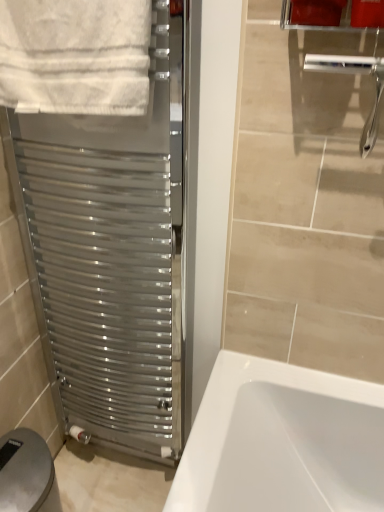
Question: Can you confirm if white cotton towel at upper left is bigger than satin metallic towel warmer at left?

Choices:
 (A) no
 (B) yes

Answer: (A)

Question: From a real-world perspective, does white cotton towel at upper left stand above satin metallic towel warmer at left?

Choices:
 (A) yes
 (B) no

Answer: (A)

Question: Is white cotton towel at upper left turned away from satin metallic towel warmer at left?

Choices:
 (A) yes
 (B) no

Answer: (A)

Question: Would you say white cotton towel at upper left is outside satin metallic towel warmer at left?

Choices:
 (A) no
 (B) yes

Answer: (A)

Question: Is white cotton towel at upper left shorter than satin metallic towel warmer at left?

Choices:
 (A) yes
 (B) no

Answer: (A)

Question: From the image's perspective, is white cotton towel at upper left over satin metallic towel warmer at left?

Choices:
 (A) no
 (B) yes

Answer: (B)

Question: From the image's perspective, would you say satin metallic towel warmer at left is shown under white cotton towel at upper left?

Choices:
 (A) yes
 (B) no

Answer: (A)

Question: Considering the relative sizes of satin metallic towel warmer at left and white cotton towel at upper left in the image provided, is satin metallic towel warmer at left thinner than white cotton towel at upper left?

Choices:
 (A) no
 (B) yes

Answer: (A)

Question: Is satin metallic towel warmer at left looking in the opposite direction of white cotton towel at upper left?

Choices:
 (A) yes
 (B) no

Answer: (A)

Question: Does satin metallic towel warmer at left contain white cotton towel at upper left?

Choices:
 (A) no
 (B) yes

Answer: (B)

Question: Does satin metallic towel warmer at left come behind white cotton towel at upper left?

Choices:
 (A) no
 (B) yes

Answer: (B)

Question: From a real-world perspective, is satin metallic towel warmer at left located beneath white cotton towel at upper left?

Choices:
 (A) no
 (B) yes

Answer: (B)

Question: Is matte plastic toilet paper holder at lower left further to camera compared to satin metallic towel warmer at left?

Choices:
 (A) no
 (B) yes

Answer: (B)